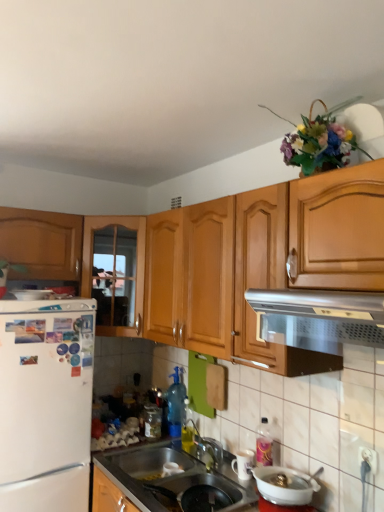
Question: From the image's perspective, is wooden cabinet at left, placed as the second cabinetry when sorted from left to right, over white glossy bowl at lower center, arranged as the 3th appliance when viewed from the left?

Choices:
 (A) no
 (B) yes

Answer: (B)

Question: Is wooden cabinet at left, placed as the second cabinetry when sorted from left to right, at the right side of white glossy bowl at lower center, acting as the 2th appliance starting from the bottom?

Choices:
 (A) no
 (B) yes

Answer: (A)

Question: Is white glossy bowl at lower center, acting as the 2th appliance starting from the bottom, surrounded by wooden cabinet at left, positioned as the first cabinetry in right-to-left order?

Choices:
 (A) yes
 (B) no

Answer: (B)

Question: Does wooden cabinet at left, positioned as the first cabinetry in right-to-left order, appear on the left side of white glossy bowl at lower center, arranged as the 3th appliance when viewed from the left?

Choices:
 (A) yes
 (B) no

Answer: (A)

Question: Is wooden cabinet at left, positioned as the first cabinetry in right-to-left order, facing away from white glossy bowl at lower center, which is the 1th appliance in front-to-back order?

Choices:
 (A) no
 (B) yes

Answer: (A)

Question: From a real-world perspective, is silver metallic vent at upper center above or below white matte refrigerator at left?

Choices:
 (A) above
 (B) below

Answer: (A)

Question: Is silver metallic vent at upper center situated inside white matte refrigerator at left or outside?

Choices:
 (A) outside
 (B) inside

Answer: (A)

Question: Considering the relative positions of silver metallic vent at upper center and white matte refrigerator at left in the image provided, is silver metallic vent at upper center to the left or to the right of white matte refrigerator at left?

Choices:
 (A) right
 (B) left

Answer: (A)

Question: Considering their positions, is silver metallic vent at upper center located in front of or behind white matte refrigerator at left?

Choices:
 (A) behind
 (B) front

Answer: (B)

Question: From their relative heights in the image, would you say white matte refrigerator at left is taller or shorter than transparent plastic spray bottle at center, which is counted as the 2th bottle, starting from the left?

Choices:
 (A) tall
 (B) short

Answer: (A)

Question: In the image, is white matte refrigerator at left positioned in front of or behind transparent plastic spray bottle at center, which is counted as the 2th bottle, starting from the left?

Choices:
 (A) front
 (B) behind

Answer: (A)

Question: Is white matte refrigerator at left wider or thinner than transparent plastic spray bottle at center, the first bottle viewed from the right?

Choices:
 (A) wide
 (B) thin

Answer: (A)

Question: Is white matte refrigerator at left bigger or smaller than transparent plastic spray bottle at center, the first bottle viewed from the right?

Choices:
 (A) big
 (B) small

Answer: (A)

Question: Based on their sizes in the image, would you say white glossy bowl at lower center, arranged as the 3th appliance when viewed from the left, is bigger or smaller than wooden cabinet at left, positioned as the first cabinetry in right-to-left order?

Choices:
 (A) small
 (B) big

Answer: (A)

Question: From the image's perspective, is white glossy bowl at lower center, arranged as the 3th appliance when viewed from the left, positioned above or below wooden cabinet at left, placed as the second cabinetry when sorted from left to right?

Choices:
 (A) below
 (B) above

Answer: (A)